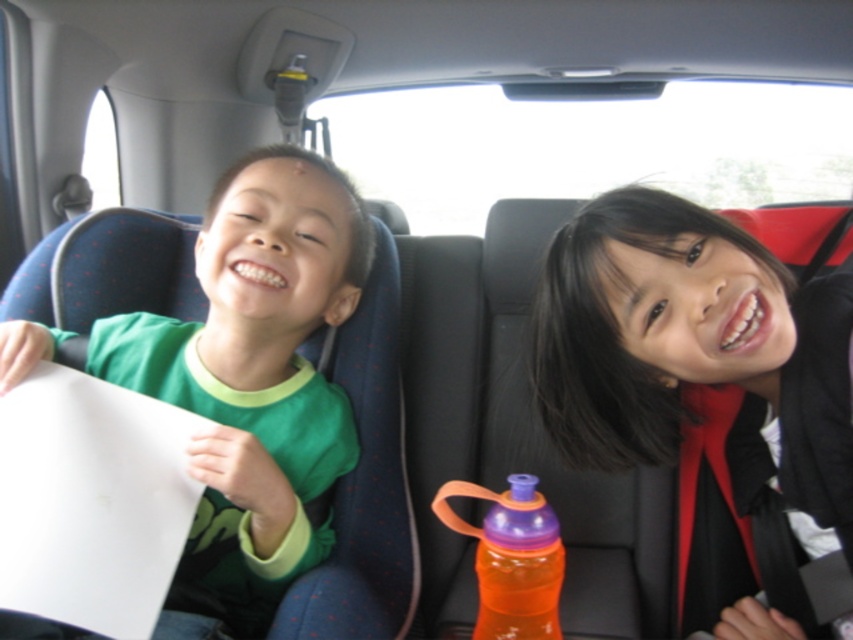
You are a passenger in the car and want to hand a small toy to the child wearing the green matte shirt at left. The orange plastic water bottle at center is blocking your path. Can you reach the child without moving the bottle?

The green matte shirt at left is much taller than the orange plastic water bottle at center, so you can reach the child wearing the green matte shirt at left without moving the bottle because the shirt is taller and visible above the bottle.

You are a passenger in the car and want to hand a small toy to the child on the right. Since the black fabric hair at upper right is blocking your view, can you still reach the green matte shirt at left to pass the toy without moving the hair?

The black fabric hair at upper right is in front of the green matte shirt at left, so you cannot directly reach the green matte shirt at left without moving the black fabric hair at upper right.

You are a passenger in the car and want to hand the orange plastic water bottle at center to the child wearing the green matte shirt at left. Can you reach the bottle from your current position?

The orange plastic water bottle at center is positioned between the two children, so you can easily reach it and hand it to the child wearing the green matte shirt at left.